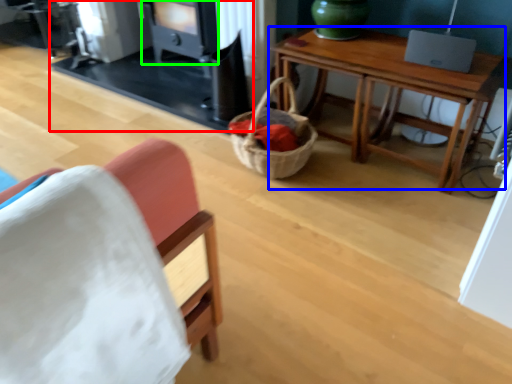
Question: Which object is positioned farthest from fireplace (highlighted by a red box)? Select from table (highlighted by a blue box) and stove (highlighted by a green box).

Choices:
 (A) table
 (B) stove

Answer: (A)